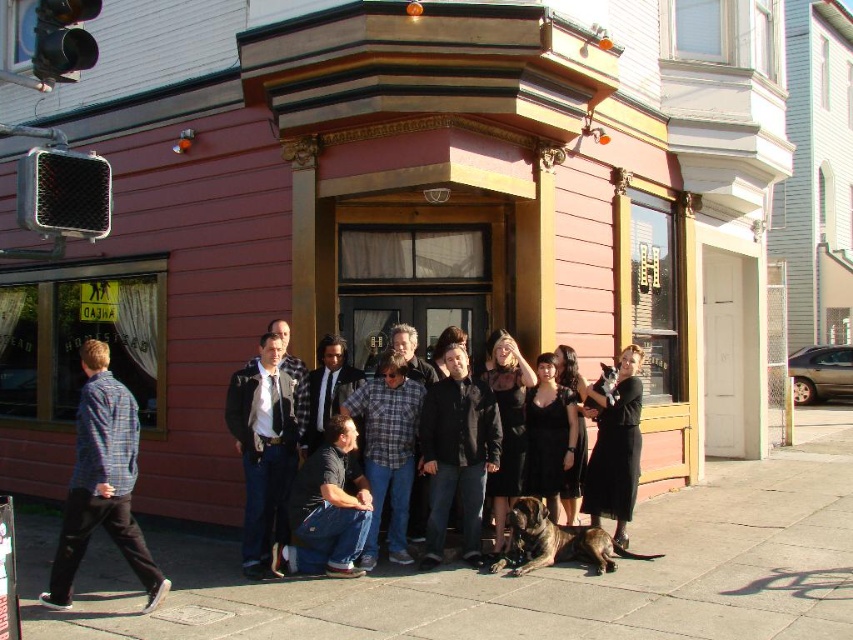
What are the coordinates of the black dress at center in the image?

The black dress at center is located at coordinates 0.697 and 0.722.

You are organizing a photoshoot and need to decide which of the two items at the scene can fit into a 1.2 meter wide display stand. The items are the black leather jacket at center and the black dress at center. Based on their sizes, which one would you choose?

The black leather jacket at center is wider than the black dress at center, so the black dress at center would fit better on the 1.2 meter wide display stand since it is narrower.